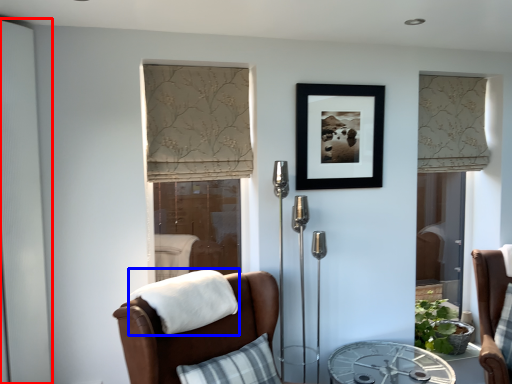
Question: Which point is further to the camera, screen door (highlighted by a red box) or blanket (highlighted by a blue box)?

Choices:
 (A) screen door
 (B) blanket

Answer: (A)